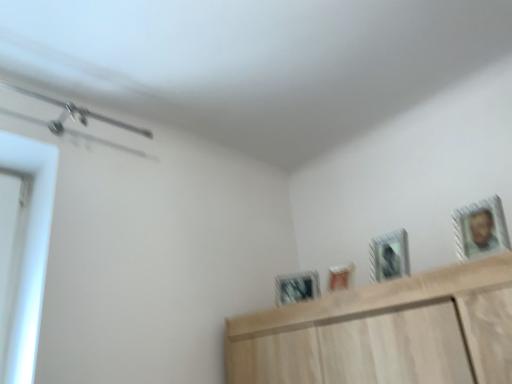
Question: Should I look upward or downward to see metallic silver picture frame at upper center, positioned as the third picture frame in left-to-right order?

Choices:
 (A) up
 (B) down

Answer: (B)

Question: Is matte white picture frame at center, marked as the 2th picture frame in a back-to-front arrangement, aimed at metallic silver picture frame at center, the fourth picture frame in the front-to-back sequence?

Choices:
 (A) yes
 (B) no

Answer: (B)

Question: Can you confirm if matte white picture frame at center, marked as the 2th picture frame in a back-to-front arrangement, is bigger than metallic silver picture frame at center, the fourth picture frame in the front-to-back sequence?

Choices:
 (A) yes
 (B) no

Answer: (B)

Question: Does matte white picture frame at center, the third picture frame in the front-to-back sequence, come in front of metallic silver picture frame at center, the first picture frame positioned from the left?

Choices:
 (A) yes
 (B) no

Answer: (A)

Question: Does matte white picture frame at center, marked as the 2th picture frame in a back-to-front arrangement, have a greater width compared to metallic silver picture frame at center, the first picture frame positioned from the left?

Choices:
 (A) no
 (B) yes

Answer: (A)

Question: Is matte white picture frame at center, marked as the 2th picture frame in a back-to-front arrangement, shorter than metallic silver picture frame at center, the fourth picture frame in the front-to-back sequence?

Choices:
 (A) no
 (B) yes

Answer: (B)

Question: Is matte white picture frame at center, marked as the 2th picture frame in a back-to-front arrangement, smaller than metallic silver picture frame at center, the fourth picture frame in the front-to-back sequence?

Choices:
 (A) yes
 (B) no

Answer: (A)

Question: Is the depth of metallic silver picture frame at upper right, which is counted as the first picture frame, starting from the right, less than that of metallic silver picture frame at upper center, which is counted as the 3th picture frame, starting from the back?

Choices:
 (A) yes
 (B) no

Answer: (A)

Question: Is metallic silver picture frame at upper right, which appears as the 4th picture frame when viewed from the left, outside metallic silver picture frame at upper center, positioned as the third picture frame in left-to-right order?

Choices:
 (A) no
 (B) yes

Answer: (B)

Question: From the image's perspective, is metallic silver picture frame at upper right, which is counted as the first picture frame, starting from the right, beneath metallic silver picture frame at upper center, positioned as the third picture frame in left-to-right order?

Choices:
 (A) yes
 (B) no

Answer: (B)

Question: Would you consider metallic silver picture frame at upper right, the 4th picture frame from the back, to be distant from metallic silver picture frame at upper center, marked as the 2th picture frame in a right-to-left arrangement?

Choices:
 (A) no
 (B) yes

Answer: (A)

Question: Is metallic silver picture frame at upper center, positioned as the third picture frame in left-to-right order, at the back of metallic silver picture frame at upper right, which is counted as the 1th picture frame, starting from the front?

Choices:
 (A) yes
 (B) no

Answer: (B)

Question: From a real-world perspective, is metallic silver picture frame at upper right, which appears as the 4th picture frame when viewed from the left, located higher than metallic silver picture frame at upper center, the 2th picture frame from the front?

Choices:
 (A) yes
 (B) no

Answer: (A)

Question: Is matte white picture frame at center, which is counted as the 3th picture frame, starting from the right, bigger than metallic silver picture frame at upper right, which appears as the 4th picture frame when viewed from the left?

Choices:
 (A) no
 (B) yes

Answer: (A)